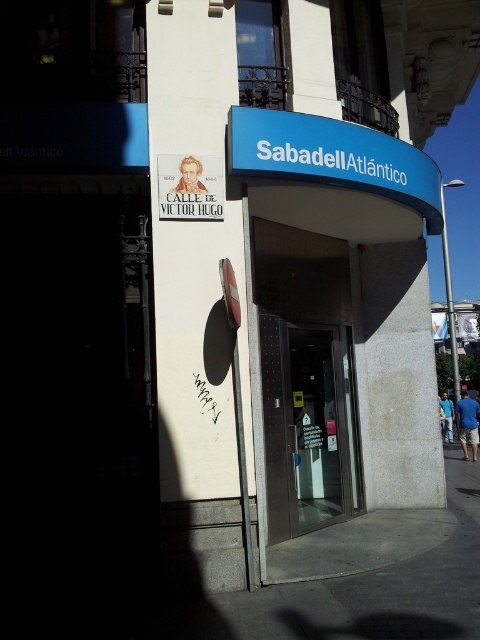
You are standing in front of the SabadellAtlantico bank entrance. There are two points marked on the facade. The first point is at coordinates point (383, 182) and the second is at point (160, 173). If you were to walk towards the entrance, which point would you encounter first?

Point (160, 173) would be encountered first because it is in front of point (383, 182).

You are a customer arriving at the bank and need to locate the entrance. You see the blue plastic sign at upper center and the white paper sign at upper left. Which sign is taller and thus more likely to catch your attention from a distance?

The blue plastic sign at upper center is taller than the white paper sign at upper left, so it is more likely to catch your attention from a distance.